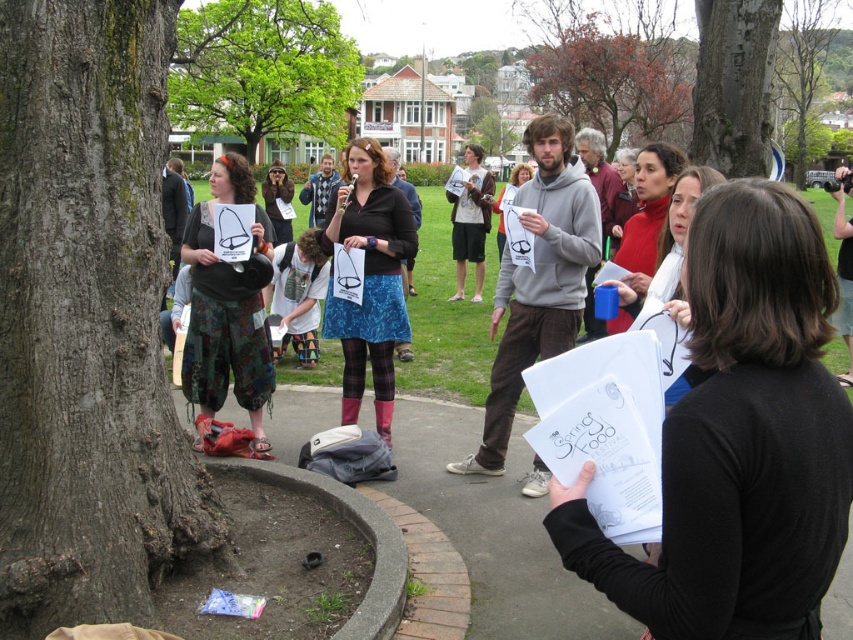
Is green leafy tree at upper right bigger than matte black hat at center?

Yes, green leafy tree at upper right is bigger than matte black hat at center.

I want to click on green leafy tree at upper right, so click(x=804, y=67).

Who is more distant from viewer, (798, 24) or (277, 160)?

The point (277, 160) is more distant.

What are the coordinates of `green leafy tree at upper right` in the screenshot? It's located at (804, 67).

Can you confirm if brown textured tree at upper center is shorter than matte black shirt at center?

In fact, brown textured tree at upper center may be taller than matte black shirt at center.

Between point (553, 86) and point (502, 204), which one is positioned behind?

The point (553, 86) is more distant.

Who is more forward, (666, 68) or (495, 202)?

Point (495, 202) is in front.

The width and height of the screenshot is (853, 640). Identify the location of brown textured tree at upper center. (612, 77).

Does dark brown bark tree at left have a larger size compared to camouflage pants at left?

No.

Which is behind, point (22, 403) or point (254, 340)?

The point (254, 340) is more distant.

Which is in front, point (149, 320) or point (200, 356)?

Point (149, 320)

Locate an element on the screen. This screenshot has width=853, height=640. dark brown bark tree at left is located at coordinates (86, 321).